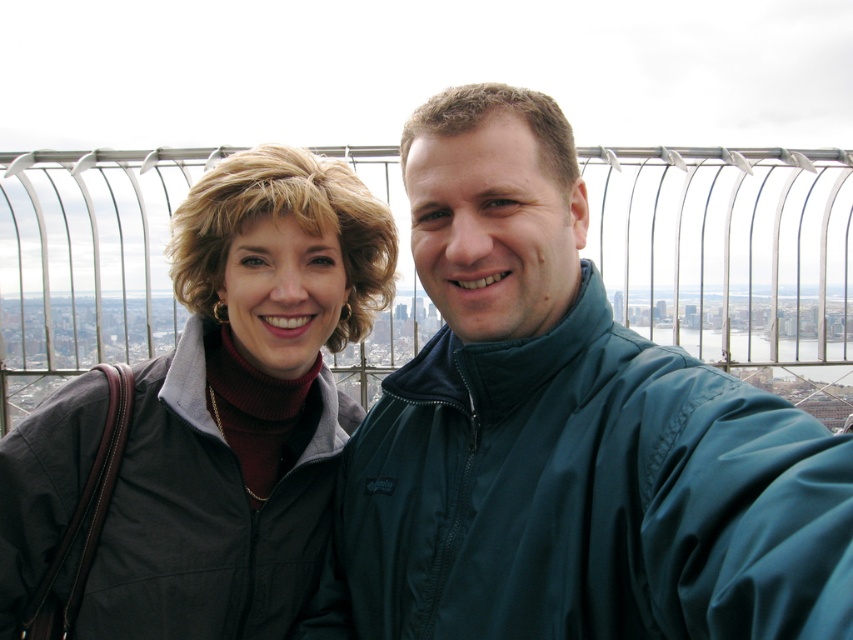
Between teal matte jacket at center and matte black jacket at left, which one is positioned higher?

Positioned higher is teal matte jacket at center.

I want to click on teal matte jacket at center, so click(566, 435).